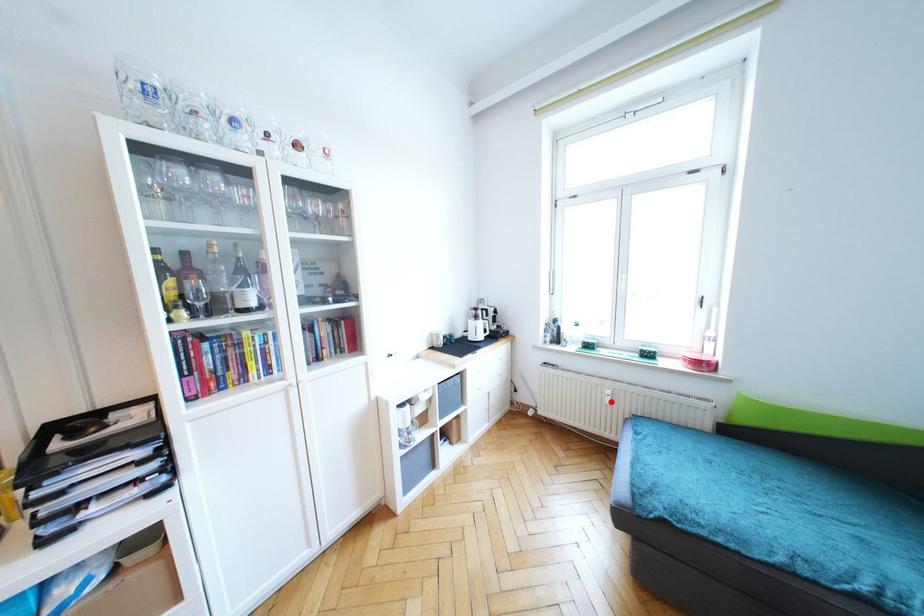
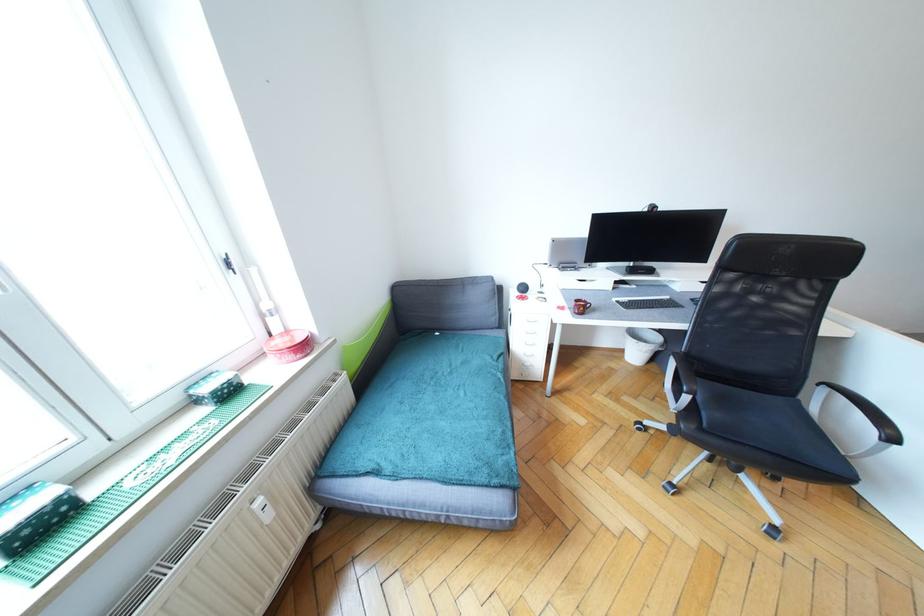
Question: I am providing you with two images of the same scene from different viewpoints. In image1, a red point is highlighted. Considering the same 3D point in image2, which of the following is correct?

Choices:
 (A) It is closer
 (B) It is farther

Answer: (A)